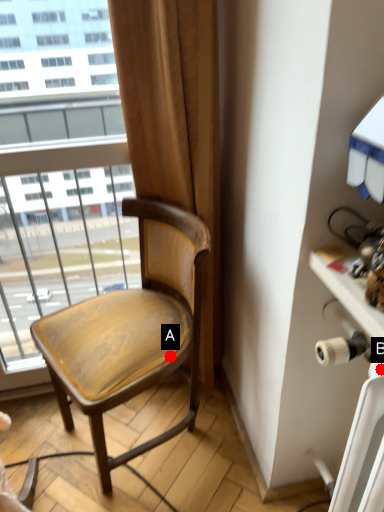
Question: Two points are circled on the image, labeled by A and B beside each circle. Which point is farther to the camera?

Choices:
 (A) A is further
 (B) B is further

Answer: (A)